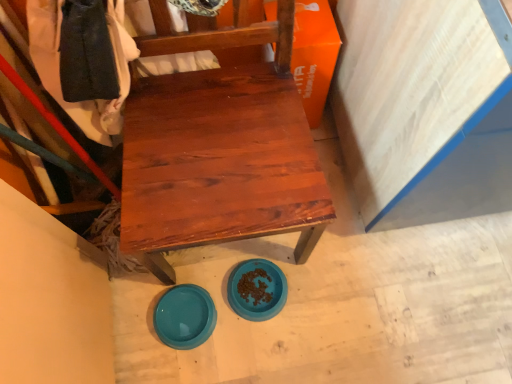
You are a GUI agent. You are given a task and a screenshot of the screen. Output one action in this format:
    pyautogui.click(x=<x>, y=<y>)
    Task: Click on the free space to the back side of blue plastic bowl at lower center, marked as the 2th plate in a left-to-right arrangement
    Image resolution: width=512 pixels, height=384 pixels.
    Given the screenshot: What is the action you would take?
    pyautogui.click(x=259, y=250)